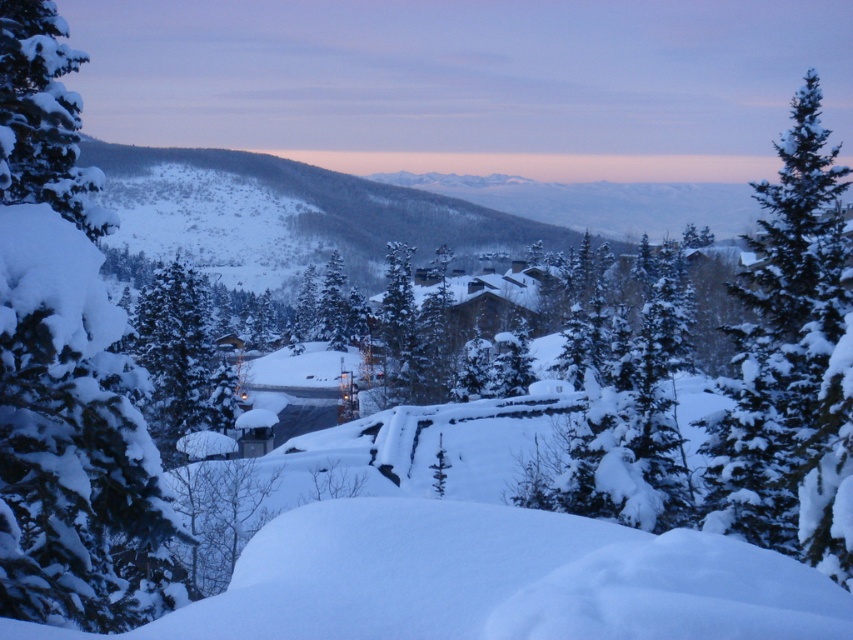
From the picture: You are standing in the winter landscape and want to take a photo. There are two points in the scene labeled as point 1 at coordinates point (74,580) and point 2 at coordinates point (786,193). Which point will appear larger in your photo?

Point 1 at coordinates point (74,580) will appear larger in the photo because it is closer to the camera than point 2 at coordinates point (786,193).